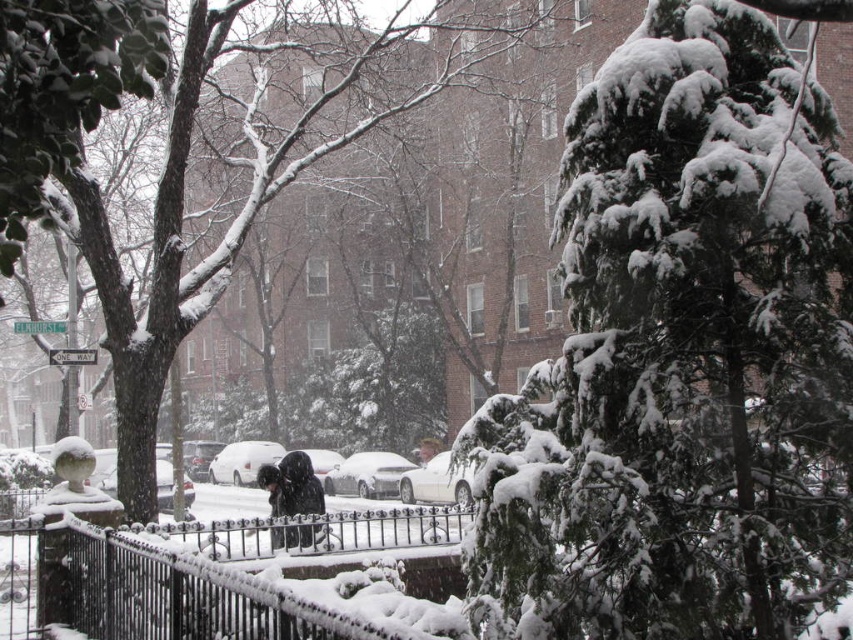
You are standing in the snowy urban scene and want to move from the point closer to you to the point further away. Which path would you take between the two points, point (572, 378) and point (293, 476)?

The point closer to the viewer is point (572, 378). To move from this point to the further point (293, 476), you would need to follow the path that goes towards the background, away from the foreground elements like the black wrought iron fence and the dense evergreen tree.